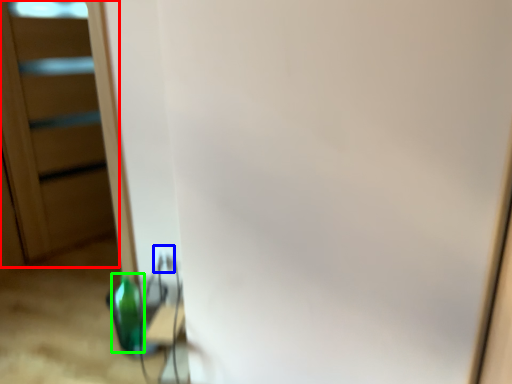
Question: Estimate the real-world distances between objects in this image. Which object is closer to screen door (highlighted by a red box), electric outlet (highlighted by a blue box) or bottle (highlighted by a green box)?

Choices:
 (A) electric outlet
 (B) bottle

Answer: (B)